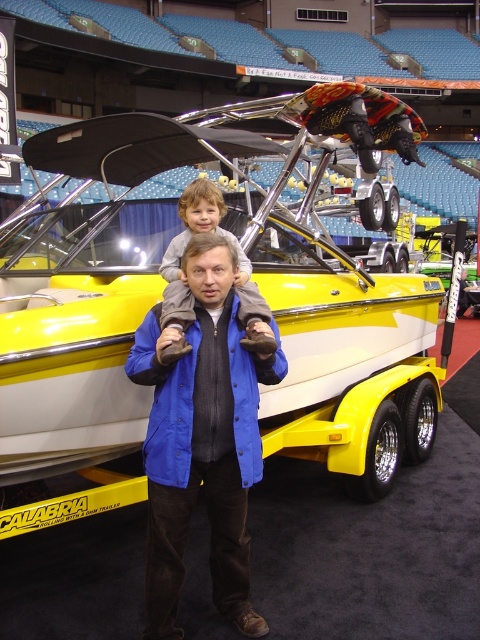
Question: Is blue fabric jacket at center positioned before light brown plush pants at center?

Choices:
 (A) yes
 (B) no

Answer: (A)

Question: Is blue fabric jacket at center smaller than light brown plush pants at center?

Choices:
 (A) no
 (B) yes

Answer: (B)

Question: Which point appears closest to the camera in this image?

Choices:
 (A) (252, 285)
 (B) (199, 308)

Answer: (B)

Question: From the image, what is the correct spatial relationship of blue fabric jacket at center in relation to light brown plush pants at center?

Choices:
 (A) below
 (B) above

Answer: (A)